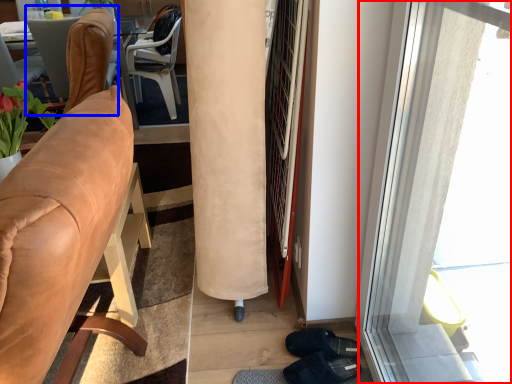
Question: Which object appears closest to the camera in this image, window (highlighted by a red box) or chair (highlighted by a blue box)?

Choices:
 (A) window
 (B) chair

Answer: (A)